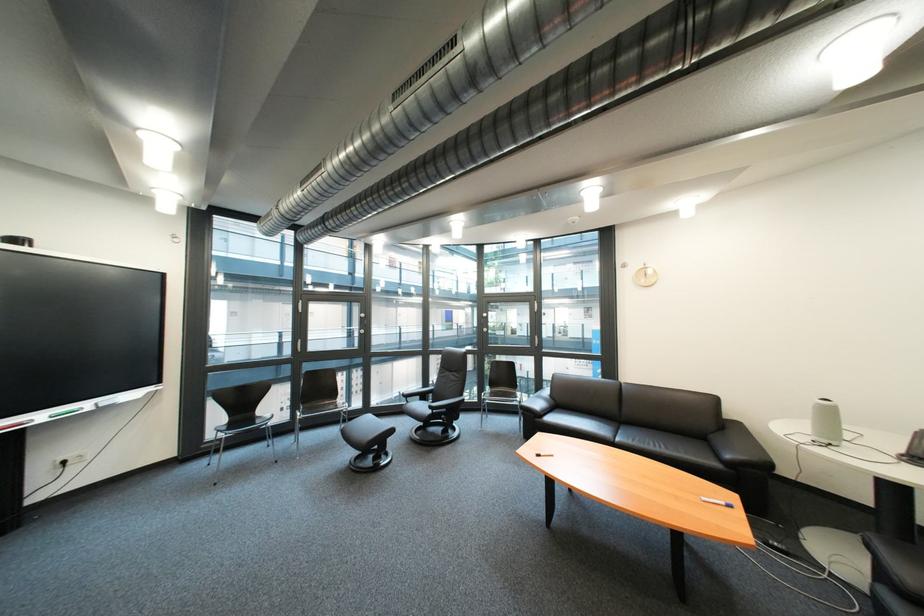
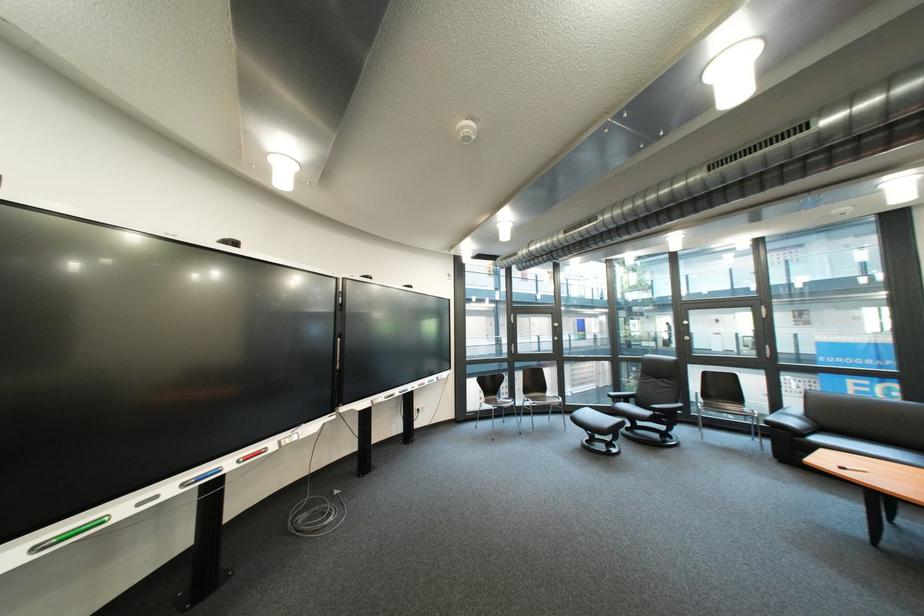
In the second image, find the point that corresponds to pixel 565 398 in the first image.

(822, 418)